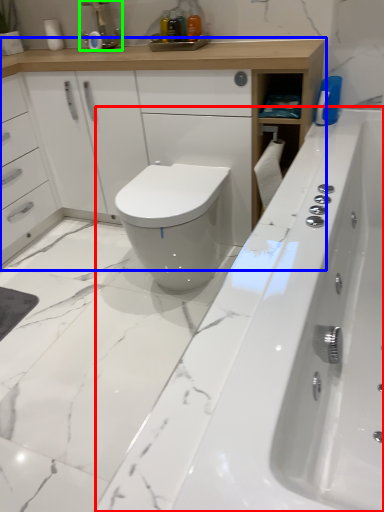
Question: Which is nearer to the bath (highlighted by a red box)? bathroom cabinet (highlighted by a blue box) or faucet (highlighted by a green box).

Choices:
 (A) bathroom cabinet
 (B) faucet

Answer: (A)